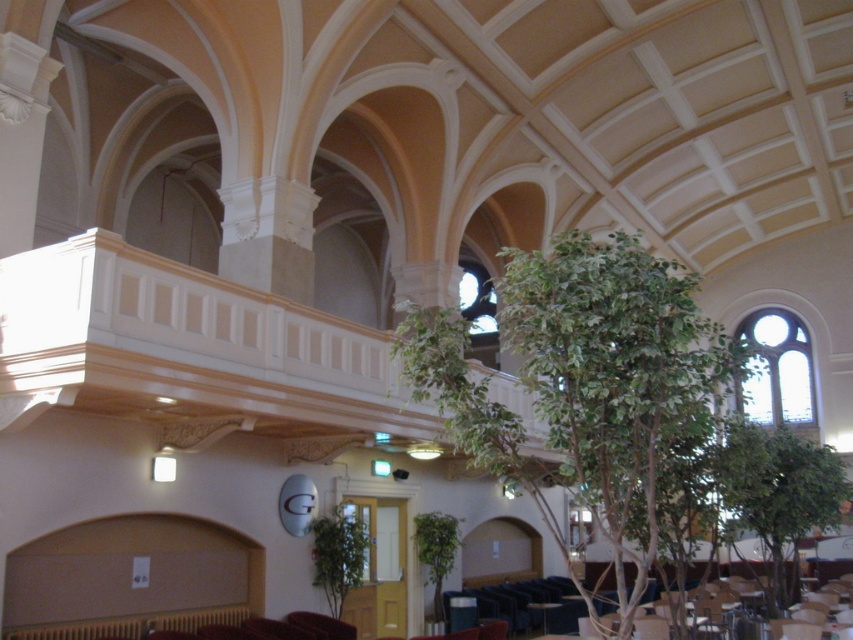
Is point (686, 433) more distant than point (840, 484)?

No, it is not.

Who is more distant from viewer, (608, 477) or (738, 508)?

The point (738, 508) is behind.

Is point (611, 497) positioned in front of point (790, 536)?

Yes, it is in front of point (790, 536).

At what (x,y) coordinates should I click in order to perform the action: click on green leafy tree at center. Please return your answer as a coordinate pair (x, y). The image size is (853, 640). Looking at the image, I should click on (x=584, y=387).